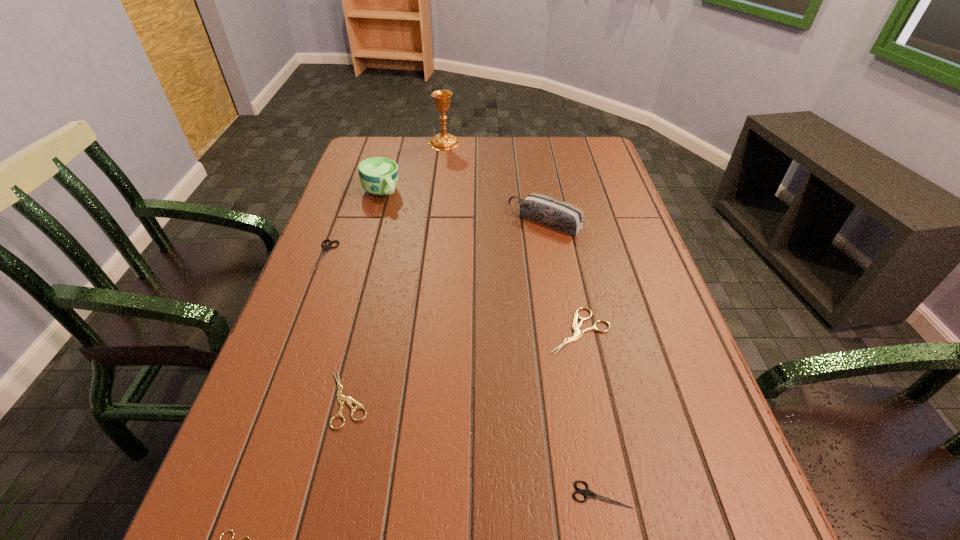
Locate an element on the screen. free space between the farthest object and the second beige shears from right to left is located at coordinates (396, 272).

This screenshot has width=960, height=540. I want to click on free space that is in between the sixth nearest object and the third shears from right to left, so click(446, 310).

You are a GUI agent. You are given a task and a screenshot of the screen. Output one action in this format:
    pyautogui.click(x=<x>, y=<y>)
    Task: Click on the free area in between the third shears from right to left and the gold chalice
    The width and height of the screenshot is (960, 540).
    Given the screenshot: What is the action you would take?
    pyautogui.click(x=396, y=272)

Locate an element on the screen. This screenshot has height=540, width=960. vacant point located between the fourth farthest shears and the second tallest object is located at coordinates (492, 344).

Where is `vacant space that is in between the farthest beige shears and the blue cup`? The width and height of the screenshot is (960, 540). vacant space that is in between the farthest beige shears and the blue cup is located at coordinates (480, 262).

Find the location of a particular element. Image resolution: width=960 pixels, height=540 pixels. vacant area that lies between the right black shears and the second nearest beige shears is located at coordinates (475, 447).

Where is `free space between the farthest object and the third shears from left to right`? Image resolution: width=960 pixels, height=540 pixels. free space between the farthest object and the third shears from left to right is located at coordinates (396, 272).

Locate an element on the screen. Image resolution: width=960 pixels, height=540 pixels. free space that is in between the blue cup and the gold chalice is located at coordinates (413, 168).

Select which object is the fourth closest to the right black shears. Please provide its 2D coordinates. Your answer should be formatted as a tuple, i.e. [(x, y)], where the tuple contains the x and y coordinates of a point satisfying the conditions above.

[(554, 213)]

At what (x,y) coordinates should I click in order to perform the action: click on object that is the third closest to the right black shears. Please return your answer as a coordinate pair (x, y). This screenshot has height=540, width=960. Looking at the image, I should click on (241, 538).